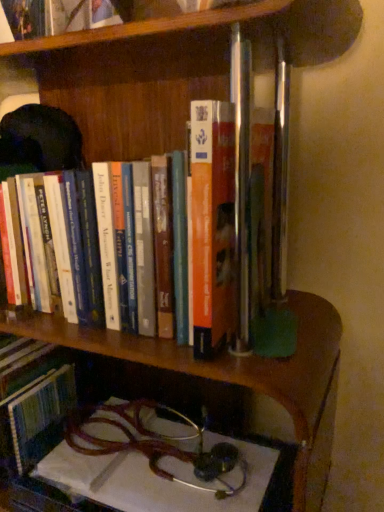
I want to click on hardcover book at upper center, which is the first book in top-to-bottom order, so click(40, 17).

Identify the location of hardcover book at upper center, positioned as the 2th book in bottom-to-top order. (40, 17).

Between point (60, 15) and point (66, 196), which one is positioned behind?

Positioned behind is point (60, 15).

Locate an element on the screen. Image resolution: width=384 pixels, height=512 pixels. book behind the hardcover book at upper center, which is the first book in top-to-bottom order is located at coordinates coord(157,240).

Consider the image. From the image's perspective, is hardcover book at upper center, which is the first book in top-to-bottom order, beneath hardcover book at center, which is counted as the second book, starting from the top?

Incorrect, from the image's perspective, hardcover book at upper center, which is the first book in top-to-bottom order, is higher than hardcover book at center, which is counted as the second book, starting from the top.

Considering the sizes of objects hardcover book at upper center, which is the first book in top-to-bottom order, and hardcover book at center, the first book when ordered from bottom to top, in the image provided, who is wider, hardcover book at upper center, which is the first book in top-to-bottom order, or hardcover book at center, the first book when ordered from bottom to top,?

hardcover book at center, the first book when ordered from bottom to top.

From a real-world perspective, is metallic stethoscope at lower center beneath hardcover book at center, the first book when ordered from bottom to top?

Indeed, from a real-world perspective, metallic stethoscope at lower center is positioned beneath hardcover book at center, the first book when ordered from bottom to top.

Which object is positioned more to the right, metallic stethoscope at lower center or hardcover book at center, which is counted as the second book, starting from the top?

Positioned to the right is metallic stethoscope at lower center.

What's the angular difference between metallic stethoscope at lower center and hardcover book at center, the first book when ordered from bottom to top,'s facing directions?

The facing directions of metallic stethoscope at lower center and hardcover book at center, the first book when ordered from bottom to top, are 0.11 degrees apart.

Is point (181, 165) closer to camera compared to point (18, 11)?

Yes, point (181, 165) is closer to viewer.

Looking at this image, are hardcover book at center, which is counted as the second book, starting from the top, and hardcover book at upper center, which is the first book in top-to-bottom order, beside each other?

No.

Could you measure the distance between hardcover book at center, the first book when ordered from bottom to top, and hardcover book at upper center, which is the first book in top-to-bottom order?

A distance of 11.76 inches exists between hardcover book at center, the first book when ordered from bottom to top, and hardcover book at upper center, which is the first book in top-to-bottom order.

Can you confirm if hardcover book at center, which is counted as the second book, starting from the top, is taller than hardcover book at upper center, which is the first book in top-to-bottom order?

Yes.

Could you tell me if hardcover book at upper center, which is the first book in top-to-bottom order, is turned towards metallic stethoscope at lower center?

No, hardcover book at upper center, which is the first book in top-to-bottom order, is not aimed at metallic stethoscope at lower center.

Are hardcover book at upper center, positioned as the 2th book in bottom-to-top order, and metallic stethoscope at lower center making contact?

They are not placed beside each other.

Who is more distant, hardcover book at upper center, which is the first book in top-to-bottom order, or metallic stethoscope at lower center?

metallic stethoscope at lower center.

From the image's perspective, who appears lower, hardcover book at center, the first book when ordered from bottom to top, or metallic stethoscope at lower center?

metallic stethoscope at lower center appears lower in the image.

Considering the relative sizes of hardcover book at center, the first book when ordered from bottom to top, and metallic stethoscope at lower center in the image provided, is hardcover book at center, the first book when ordered from bottom to top, thinner than metallic stethoscope at lower center?

Yes, hardcover book at center, the first book when ordered from bottom to top, is thinner than metallic stethoscope at lower center.

Consider the image. Is hardcover book at center, the first book when ordered from bottom to top, positioned with its back to metallic stethoscope at lower center?

No, hardcover book at center, the first book when ordered from bottom to top,'s orientation is not away from metallic stethoscope at lower center.

Where is `the 1st book above when counting from the metallic stethoscope at lower center (from the image's perspective)`? the 1st book above when counting from the metallic stethoscope at lower center (from the image's perspective) is located at coordinates (157, 240).

Where is `shelf that appears below the hardcover book at upper center, which is the first book in top-to-bottom order (from the image's perspective)`? The image size is (384, 512). shelf that appears below the hardcover book at upper center, which is the first book in top-to-bottom order (from the image's perspective) is located at coordinates (234, 370).

Is the surface of metallic stethoscope at lower center in direct contact with hardcover book at upper center, positioned as the 2th book in bottom-to-top order?

metallic stethoscope at lower center and hardcover book at upper center, positioned as the 2th book in bottom-to-top order, are not in contact.

Based on the photo, from the image's perspective, which is below, metallic stethoscope at lower center or hardcover book at upper center, positioned as the 2th book in bottom-to-top order?

From the image's view, metallic stethoscope at lower center is below.

Locate an element on the screen. book below the hardcover book at upper center, which is the first book in top-to-bottom order (from a real-world perspective) is located at coordinates (157, 240).

From the metallic stethoscope at lower center, count the 2nd book to the left and point to it. Please provide its 2D coordinates.

[(157, 240)]

Estimate the real-world distances between objects in this image. Which object is closer to hardcover book at center, which is counted as the second book, starting from the top, metallic stethoscope at lower center or hardcover book at upper center, which is the first book in top-to-bottom order?

metallic stethoscope at lower center.

Estimate the real-world distances between objects in this image. Which object is further from hardcover book at center, which is counted as the second book, starting from the top, hardcover book at upper center, positioned as the 2th book in bottom-to-top order, or metallic stethoscope at lower center?

Among the two, hardcover book at upper center, positioned as the 2th book in bottom-to-top order, is located further to hardcover book at center, which is counted as the second book, starting from the top.

Estimate the real-world distances between objects in this image. Which object is closer to hardcover book at upper center, which is the first book in top-to-bottom order, hardcover book at center, which is counted as the second book, starting from the top, or metallic stethoscope at lower center?

Among the two, hardcover book at center, which is counted as the second book, starting from the top, is located nearer to hardcover book at upper center, which is the first book in top-to-bottom order.

Based on their spatial positions, is hardcover book at upper center, which is the first book in top-to-bottom order, or hardcover book at center, the first book when ordered from bottom to top, closer to metallic stethoscope at lower center?

hardcover book at center, the first book when ordered from bottom to top, is positioned closer to the anchor metallic stethoscope at lower center.

Which object lies further to the anchor point metallic stethoscope at lower center, hardcover book at center, the first book when ordered from bottom to top, or hardcover book at upper center, which is the first book in top-to-bottom order?

hardcover book at upper center, which is the first book in top-to-bottom order, is further to metallic stethoscope at lower center.

From the image, which object appears to be farther from hardcover book at upper center, positioned as the 2th book in bottom-to-top order, metallic stethoscope at lower center or hardcover book at center, which is counted as the second book, starting from the top?

metallic stethoscope at lower center is positioned further to the anchor hardcover book at upper center, positioned as the 2th book in bottom-to-top order.

At what (x,y) coordinates should I click in order to perform the action: click on book between hardcover book at upper center, which is the first book in top-to-bottom order, and metallic stethoscope at lower center in the up-down direction. Please return your answer as a coordinate pair (x, y). This screenshot has width=384, height=512. Looking at the image, I should click on (157, 240).